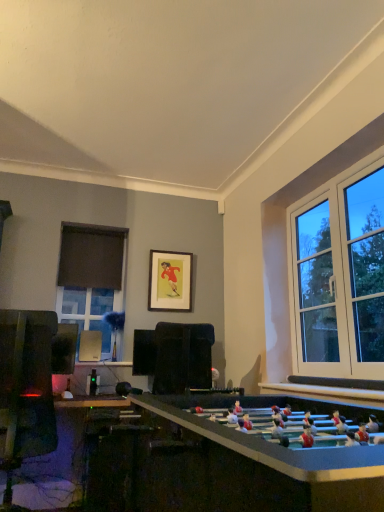
The image size is (384, 512). I want to click on matte glass window at left, so tap(87, 311).

Would you say matte glass window at left is outside wooden framed picture at center?

Yes.

Based on the photo, is matte glass window at left oriented towards wooden framed picture at center?

No, matte glass window at left is not facing towards wooden framed picture at center.

Considering the positions of points (96, 329) and (170, 262), is point (96, 329) farther from camera compared to point (170, 262)?

No, (96, 329) is in front of (170, 262).

Is matte glass window at left not near wooden framed picture at center?

No.

Consider the image. Is wooden framed picture at center not near matte glass window at left?

No, there isn't a large distance between wooden framed picture at center and matte glass window at left.

Is point (175, 310) less distant than point (81, 301)?

No, it is behind (81, 301).

From the image's perspective, would you say wooden framed picture at center is shown under matte glass window at left?

No, from the image's perspective, wooden framed picture at center is not beneath matte glass window at left.

Consider the image. Does wooden framed picture at center have a greater width compared to black fabric curtain at left?

No.

Can you tell me how much wooden framed picture at center and black fabric curtain at left differ in facing direction?

They differ by 0.253 degrees in their facing directions.

Does point (168, 294) come closer to viewer compared to point (73, 275)?

That is False.

From the image's perspective, which is below, black fabric curtain at left or wooden framed picture at center?

wooden framed picture at center, from the image's perspective.

Is black fabric curtain at left shorter than wooden framed picture at center?

Yes.

Which is closer to the camera, [119,244] or [163,258]?

Point [119,244].

From a real-world perspective, is black fabric curtain at left physically located above or below wooden framed picture at center?

Clearly, from a real-world perspective, black fabric curtain at left is above wooden framed picture at center.

Consider the image. Is black fabric curtain at left located within matte glass window at left?

No, black fabric curtain at left is not inside matte glass window at left.

From the image's perspective, which is below, matte glass window at left or black fabric curtain at left?

matte glass window at left is shown below in the image.

Relative to black fabric curtain at left, is matte glass window at left in front or behind?

matte glass window at left is in front of black fabric curtain at left.

From a real-world perspective, is matte glass window at left positioned under black fabric curtain at left based on gravity?

Yes, from a real-world perspective, matte glass window at left is beneath black fabric curtain at left.

Looking at this image, from the image's perspective, is black fabric curtain at left located above or below matte glass window at left?

From the image's perspective, black fabric curtain at left appears above matte glass window at left.

Are black fabric curtain at left and matte glass window at left beside each other?

black fabric curtain at left is not next to matte glass window at left, and they're not touching.

Which is in front, point (64, 234) or point (100, 296)?

The point (100, 296) is closer.

The height and width of the screenshot is (512, 384). In order to click on picture frame lying behind the matte glass window at left in this screenshot , I will do `click(170, 281)`.

The width and height of the screenshot is (384, 512). In order to click on window that appears below the wooden framed picture at center (from a real-world perspective) in this screenshot , I will do `click(87, 311)`.

When comparing their distances from black fabric curtain at left, does matte glass window at left or wooden framed picture at center seem further?

wooden framed picture at center lies further to black fabric curtain at left than the other object.

Looking at the image, which one is located further to matte glass window at left, black fabric curtain at left or wooden framed picture at center?

wooden framed picture at center lies further to matte glass window at left than the other object.

Based on the photo, based on their spatial positions, is matte glass window at left or black fabric curtain at left closer to wooden framed picture at center?

black fabric curtain at left lies closer to wooden framed picture at center than the other object.

Considering their positions, is wooden framed picture at center positioned further to matte glass window at left than black fabric curtain at left?

Based on the image, wooden framed picture at center appears to be further to matte glass window at left.

Which object lies further to the anchor point black fabric curtain at left, wooden framed picture at center or matte glass window at left?

Based on the image, wooden framed picture at center appears to be further to black fabric curtain at left.

Considering their positions, is black fabric curtain at left positioned closer to wooden framed picture at center than matte glass window at left?

black fabric curtain at left lies closer to wooden framed picture at center than the other object.

At what (x,y) coordinates should I click in order to perform the action: click on curtain between matte glass window at left and wooden framed picture at center from left to right. Please return your answer as a coordinate pair (x, y). Image resolution: width=384 pixels, height=512 pixels. Looking at the image, I should click on (91, 256).